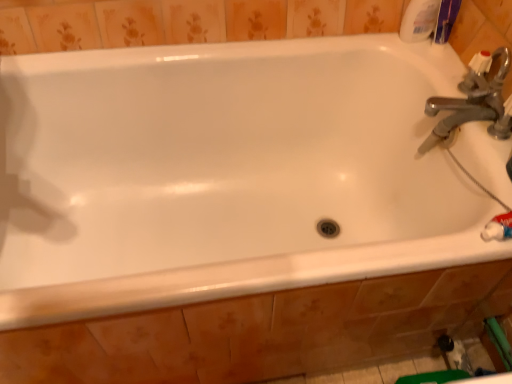
This screenshot has width=512, height=384. In order to click on silver metallic faucet at upper right in this screenshot , I will do `click(472, 105)`.

Consider the image. What is the approximate width of silver metallic faucet at upper right?

The width of silver metallic faucet at upper right is 7.82 inches.

This screenshot has height=384, width=512. Describe the element at coordinates (472, 105) in the screenshot. I see `silver metallic faucet at upper right` at that location.

This screenshot has width=512, height=384. What are the coordinates of `silver metallic faucet at upper right` in the screenshot? It's located at (472, 105).